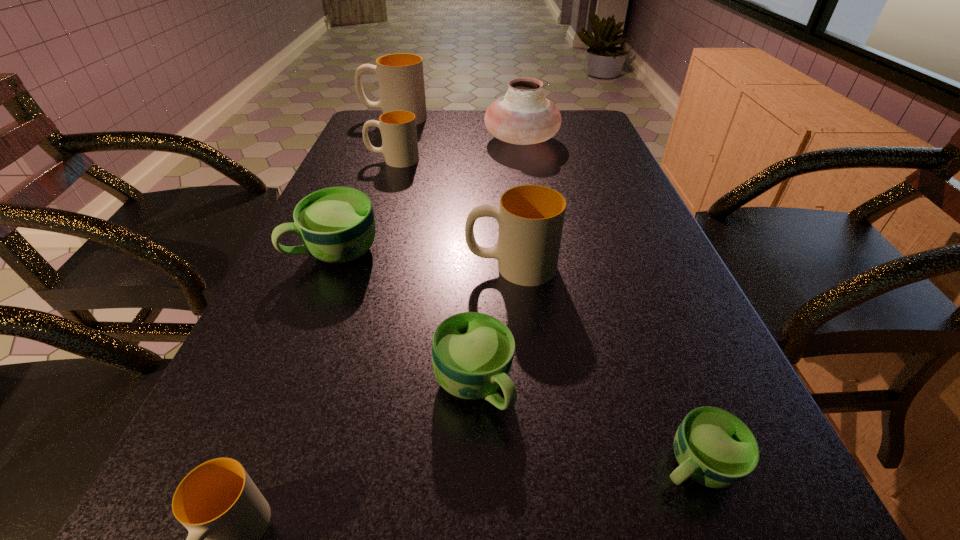
Identify the location of the tallest cup. (401, 79).

Identify the location of the farthest yellow cup. (401, 79).

This screenshot has height=540, width=960. Find the location of `pottery`. pottery is located at coordinates pyautogui.click(x=523, y=116).

Identify the location of the sixth shortest cup. (530, 217).

This screenshot has height=540, width=960. I want to click on the third farthest yellow cup, so click(530, 217).

Find the location of a particular element. the third nearest yellow cup is located at coordinates (398, 128).

The height and width of the screenshot is (540, 960). Find the location of `the third biggest yellow cup`. the third biggest yellow cup is located at coordinates (398, 128).

Find the location of a particular element. The image size is (960, 540). the farthest blue cup is located at coordinates (337, 225).

Locate an element on the screen. The image size is (960, 540). the leftmost blue cup is located at coordinates (337, 225).

Image resolution: width=960 pixels, height=540 pixels. Find the location of `the second blue cup from right to left`. the second blue cup from right to left is located at coordinates [472, 353].